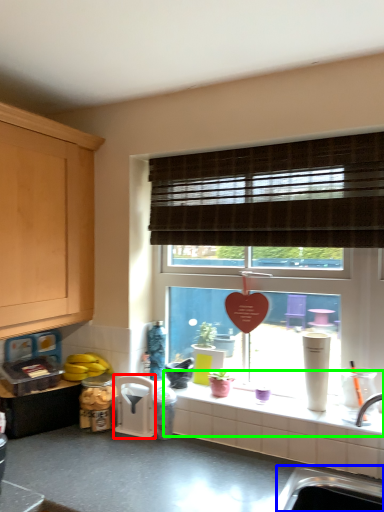
Question: Which is nearer to the appliance (highlighted by a red box)? sink (highlighted by a blue box) or window sill (highlighted by a green box).

Choices:
 (A) sink
 (B) window sill

Answer: (B)